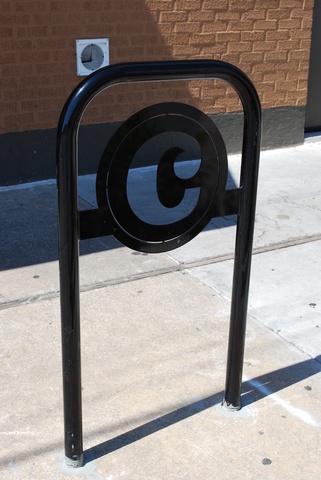
The height and width of the screenshot is (480, 321). I want to click on wall, so click(x=192, y=19).